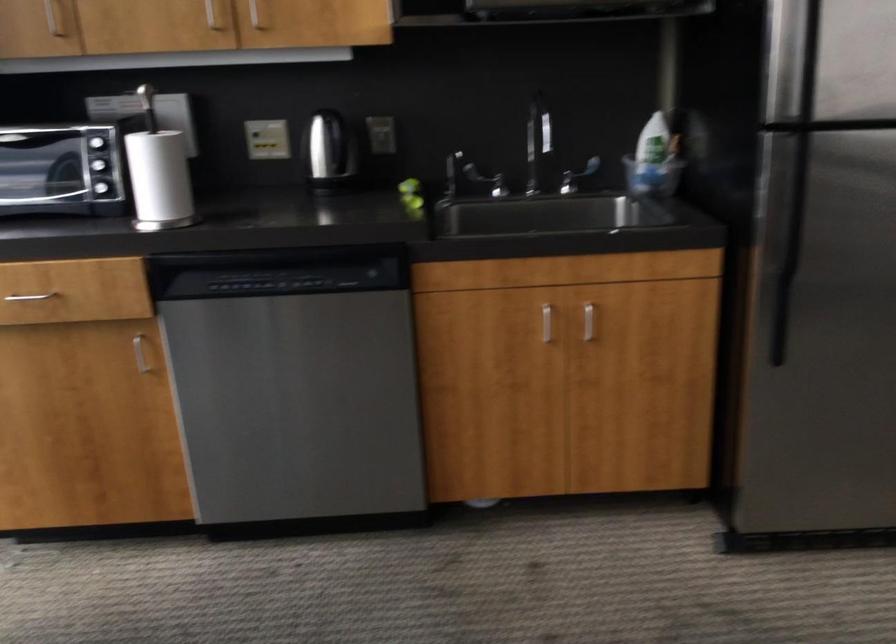
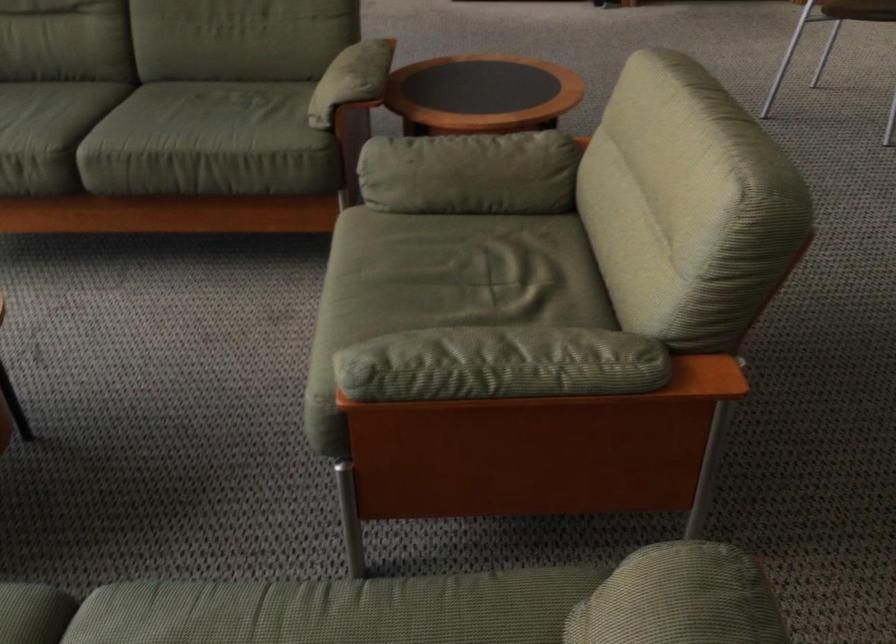
Question: Which direction would the cameraman need to move to produce the second image? Reply with the corresponding letter.

Choices:
 (A) Left
 (B) Right
 (C) Forward
 (D) Backward

Answer: (D)